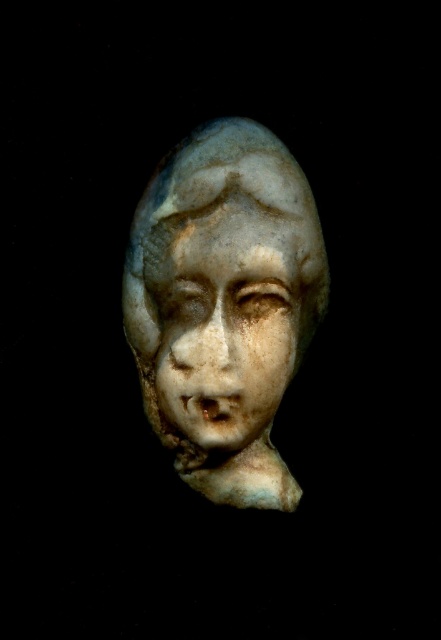
You are standing 5 feet away from the sculpture. A point at coordinates point (x=154, y=323) is part of the sculpture. Can you reach this point without moving closer to the sculpture?

The distance of point (x=154, y=323) from viewer is 4.28 feet. Since you are standing 5 feet away from the sculpture, the point is 0.72 feet closer than your current position. Therefore, you cannot reach the point without moving closer to the sculpture.

You are an art conservator examining the white marble bust at center and the white marble face at center in the image. Which of these two objects is positioned higher in the image?

The white marble bust at center is positioned higher than the white marble face at center in the image.

You are an art conservator examining the image of a stone sculpture. You notice two objects labeled as the white marble bust at center and the white marble face at center. Based on their positions, which one is located to the right?

The white marble bust at center is to the right of the white marble face at center, so the white marble bust at center is located to the right.